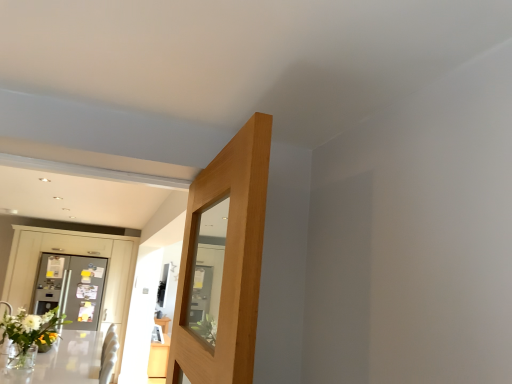
Question: Is metallic gray dresser at left wider or thinner than clear glass table at lower left, placed as the second table when sorted from bottom to top?

Choices:
 (A) thin
 (B) wide

Answer: (A)

Question: From the image's perspective, relative to clear glass table at lower left, the first table from the front, is metallic gray dresser at left above or below?

Choices:
 (A) below
 (B) above

Answer: (B)

Question: Estimate the real-world distances between objects in this image. Which object is farther from the clear glass table at lower left, which is the 1th table in top-to-bottom order?

Choices:
 (A) metallic silver refrigerator at left
 (B) metallic gray dresser at left
 (C) light wood table at lower left, which appears as the second table when viewed from the top

Answer: (B)

Question: Which of these objects is positioned farthest from the clear glass table at lower left, placed as the second table when sorted from bottom to top?

Choices:
 (A) metallic gray dresser at left
 (B) light wood table at lower left, which is the second table from front to back
 (C) metallic silver refrigerator at left

Answer: (A)